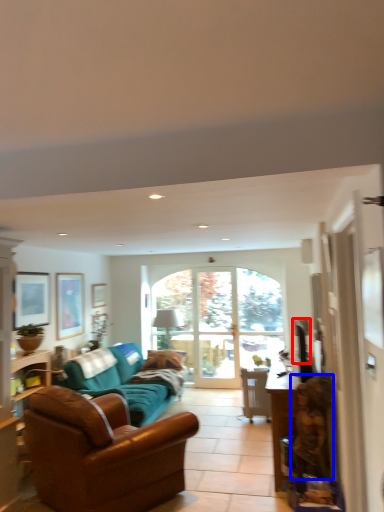
Question: Which point is further to the camera, television (highlighted by a red box) or person (highlighted by a blue box)?

Choices:
 (A) television
 (B) person

Answer: (A)